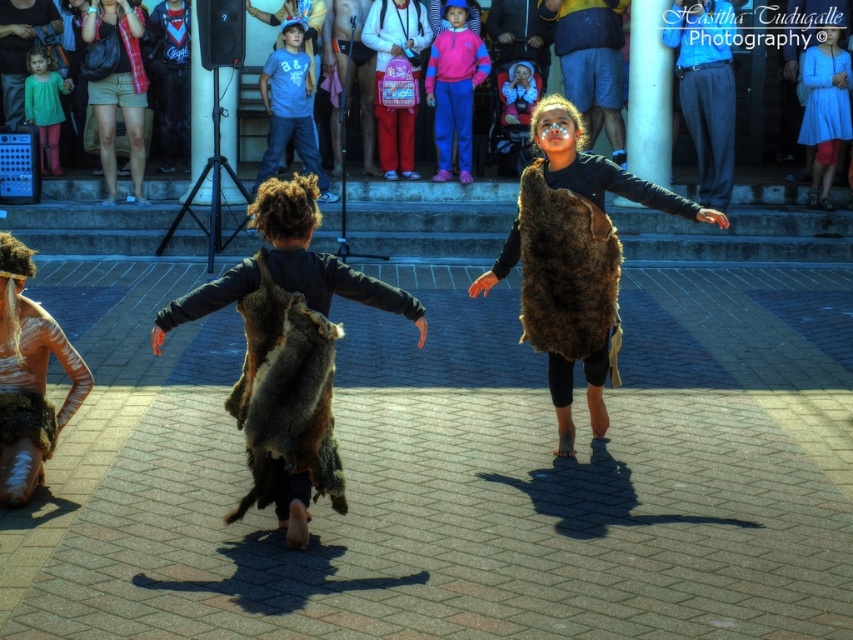
Is point (166, 321) closer to camera compared to point (47, 131)?

Yes.

Does point (218, 280) come farther from viewer compared to point (54, 129)?

No, it is not.

At what (x,y) coordinates should I click in order to perform the action: click on brown fur coat at center. Please return your answer as a coordinate pair (x, y). Looking at the image, I should click on (334, 280).

Is blue fabric pants at upper right positioned before matte green dress at upper left?

That is True.

Describe the element at coordinates (706, 88) in the screenshot. I see `blue fabric pants at upper right` at that location.

Is point (672, 10) behind point (42, 52)?

No, it is in front of (42, 52).

Identify the location of blue fabric pants at upper right. This screenshot has height=640, width=853. (706, 88).

Which is more to the left, brown furry vest at center or brown fur coat at center?

brown fur coat at center is more to the left.

Between brown furry vest at center and brown fur coat at center, which one is positioned lower?

brown fur coat at center

At what (x,y) coordinates should I click in order to perform the action: click on brown furry vest at center. Please return your answer as a coordinate pair (x, y). Looking at the image, I should click on (573, 257).